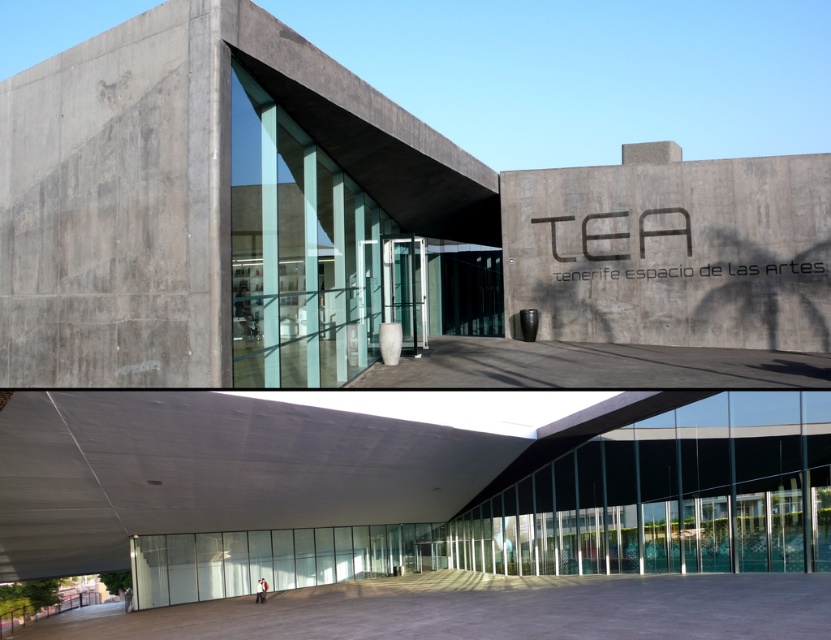
Question: Is concrete textured wall at center to the right of gray concrete at lower center from the viewer's perspective?

Choices:
 (A) yes
 (B) no

Answer: (A)

Question: Does light beige fabric jacket at center appear over light gray concrete person at center?

Choices:
 (A) no
 (B) yes

Answer: (B)

Question: Which is farther from the light beige fabric jacket at center?

Choices:
 (A) light gray concrete person at center
 (B) gray concrete at lower center

Answer: (B)

Question: Considering the real-world distances, which object is farthest from the gray concrete at lower center?

Choices:
 (A) concrete textured wall at center
 (B) light gray concrete person at center

Answer: (B)

Question: Which point is farther to the camera?

Choices:
 (A) light beige fabric jacket at center
 (B) gray concrete at lower center
 (C) concrete wall at center

Answer: (A)

Question: In this image, where is concrete textured wall at center located relative to light beige fabric jacket at center?

Choices:
 (A) below
 (B) above

Answer: (B)